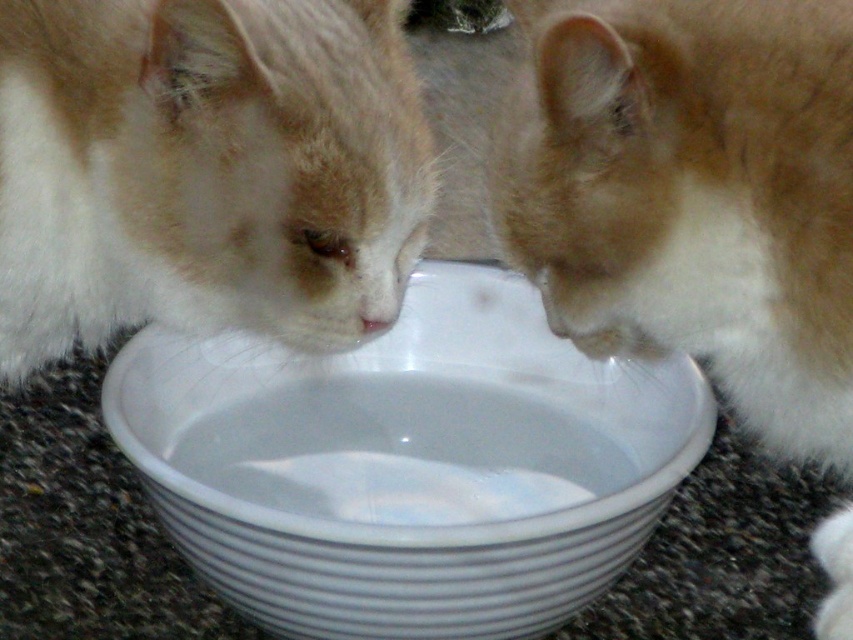
Measure the distance between white glossy bowl at center and fluffy orange-white cat at center.

They are 8.15 inches apart.

What do you see at coordinates (409, 465) in the screenshot? The height and width of the screenshot is (640, 853). I see `white glossy bowl at center` at bounding box center [409, 465].

Is point (688, 401) behind point (828, 36)?

Yes, it is.

Locate an element on the screen. The image size is (853, 640). white glossy bowl at center is located at coordinates (409, 465).

Is white glossy bowl at center above fluffy white cat at left?

No.

Which is in front, point (225, 426) or point (0, 122)?

Point (0, 122) is in front.

Is point (271, 529) in front of point (338, 38)?

That is True.

I want to click on white glossy bowl at center, so click(409, 465).

Does fluffy white cat at left have a greater width compared to fluffy orange-white cat at center?

Yes, fluffy white cat at left is wider than fluffy orange-white cat at center.

The image size is (853, 640). What do you see at coordinates (206, 170) in the screenshot? I see `fluffy white cat at left` at bounding box center [206, 170].

I want to click on fluffy white cat at left, so click(206, 170).